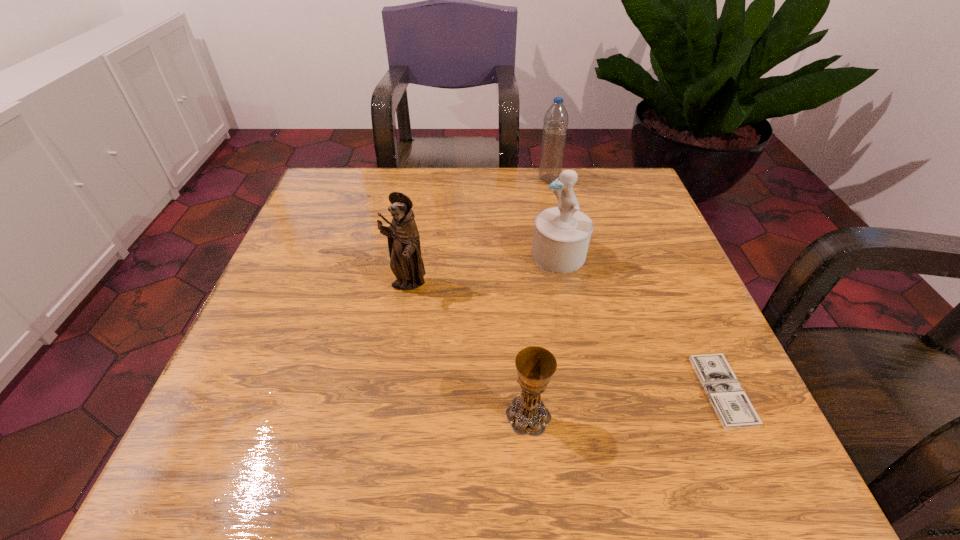
This screenshot has height=540, width=960. Identify the location of vacant space that satisfies the following two spatial constraints: 1. on the front-facing side of the left figurine; 2. on the right side of the chalice. (385, 415).

Identify the location of free point that satisfies the following two spatial constraints: 1. at the beak of the right figurine; 2. on the front-facing side of the leftmost object. This screenshot has width=960, height=540. (564, 285).

At what (x,y) coordinates should I click in order to perform the action: click on free space in the image that satisfies the following two spatial constraints: 1. at the beak of the right figurine; 2. on the front-facing side of the left figurine. Please return your answer as a coordinate pair (x, y). Image resolution: width=960 pixels, height=540 pixels. Looking at the image, I should click on (564, 285).

Where is `vacant space that satisfies the following two spatial constraints: 1. on the front side of the farthest object; 2. on the left side of the shortest object`? This screenshot has height=540, width=960. vacant space that satisfies the following two spatial constraints: 1. on the front side of the farthest object; 2. on the left side of the shortest object is located at coordinates tap(593, 390).